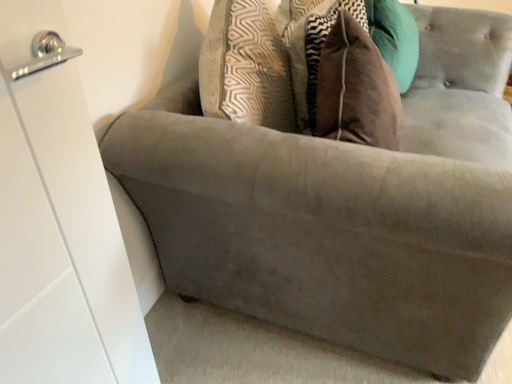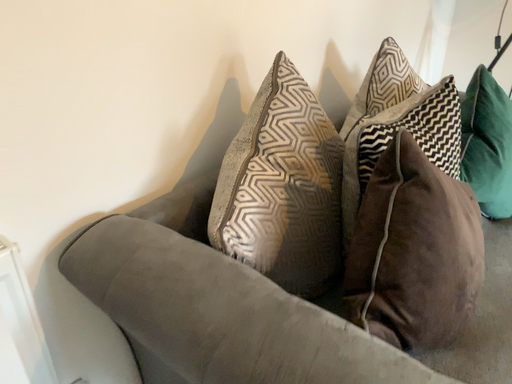
Question: How did the camera likely rotate when shooting the video?

Choices:
 (A) rotated right
 (B) rotated left

Answer: (B)